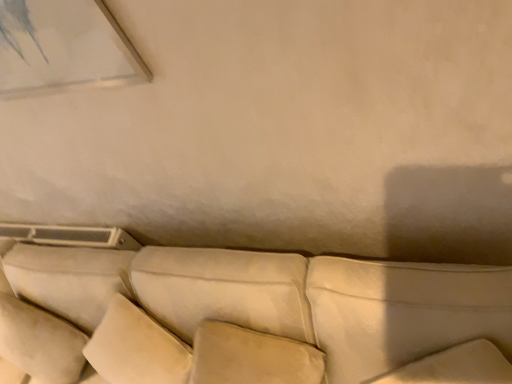
Question: From a real-world perspective, is suede-like beige couch at center below suede-like beige pillow at center, the 2th pillow when ordered from right to left?

Choices:
 (A) no
 (B) yes

Answer: (B)

Question: From a real-world perspective, is suede-like beige couch at center on suede-like beige pillow at center, the 2th pillow when ordered from right to left?

Choices:
 (A) yes
 (B) no

Answer: (B)

Question: Does suede-like beige couch at center appear on the right side of suede-like beige pillow at center, the 2th pillow when ordered from right to left?

Choices:
 (A) yes
 (B) no

Answer: (B)

Question: From the image's perspective, would you say suede-like beige couch at center is positioned over suede-like beige pillow at center, the 2th pillow when ordered from right to left?

Choices:
 (A) no
 (B) yes

Answer: (B)

Question: Is suede-like beige couch at center next to suede-like beige pillow at center, the second pillow in the left-to-right sequence?

Choices:
 (A) yes
 (B) no

Answer: (B)

Question: In terms of width, does suede-like beige pillow at center, the 2th pillow when ordered from right to left, look wider or thinner when compared to white leather pillow at lower right, which is counted as the 3th pillow, starting from the left?

Choices:
 (A) thin
 (B) wide

Answer: (A)

Question: From a real-world perspective, relative to white leather pillow at lower right, which is counted as the 3th pillow, starting from the left, is suede-like beige pillow at center, the 2th pillow when ordered from right to left, vertically above or below?

Choices:
 (A) above
 (B) below

Answer: (B)

Question: From the image's perspective, is suede-like beige pillow at center, the second pillow in the left-to-right sequence, positioned above or below white leather pillow at lower right, which is counted as the 3th pillow, starting from the left?

Choices:
 (A) above
 (B) below

Answer: (B)

Question: Relative to white leather pillow at lower right, which ranks as the first pillow in right-to-left order, is suede-like beige pillow at center, the second pillow in the left-to-right sequence, in front or behind?

Choices:
 (A) front
 (B) behind

Answer: (B)

Question: Which is correct: suede-like beige couch at center is inside white leather pillow at lower right, which ranks as the first pillow in right-to-left order, or outside of it?

Choices:
 (A) inside
 (B) outside

Answer: (B)

Question: From the image's perspective, relative to white leather pillow at lower right, which is counted as the 3th pillow, starting from the left, is suede-like beige couch at center above or below?

Choices:
 (A) above
 (B) below

Answer: (B)

Question: From a real-world perspective, is suede-like beige couch at center physically located above or below white leather pillow at lower right, which is counted as the 3th pillow, starting from the left?

Choices:
 (A) above
 (B) below

Answer: (B)

Question: Does point (318, 317) appear closer or farther from the camera than point (484, 278)?

Choices:
 (A) farther
 (B) closer

Answer: (A)

Question: Is white leather pillow at lower right, which is counted as the 3th pillow, starting from the left, to the left or to the right of suede-like beige couch at center in the image?

Choices:
 (A) right
 (B) left

Answer: (A)

Question: Considering the positions of point (421, 324) and point (333, 309), is point (421, 324) closer or farther from the camera than point (333, 309)?

Choices:
 (A) farther
 (B) closer

Answer: (B)